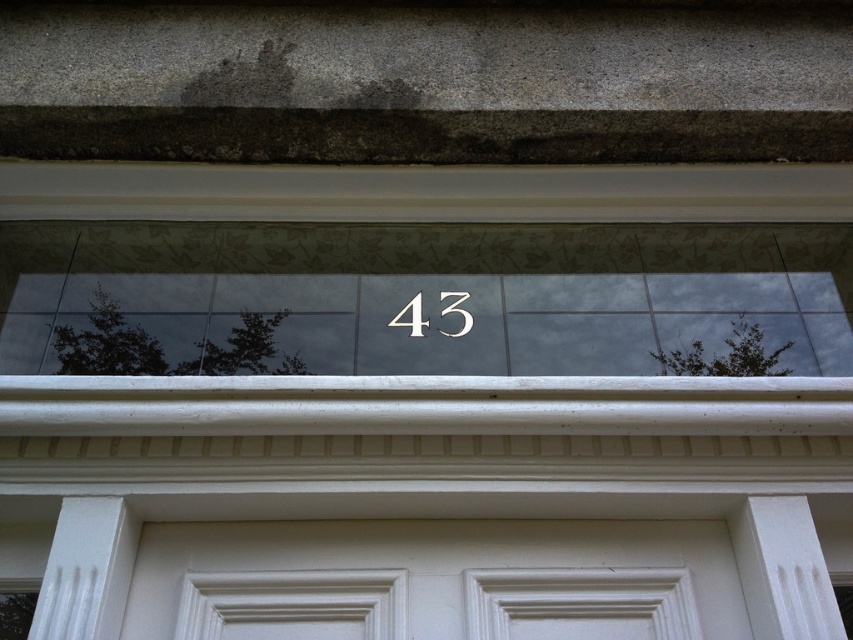
Question: Is transparent glass at center to the right of black metallic number at center from the viewer's perspective?

Choices:
 (A) no
 (B) yes

Answer: (B)

Question: Which point is closer to the camera?

Choices:
 (A) transparent glass at center
 (B) black metallic number at center

Answer: (A)

Question: Can you confirm if transparent glass at center is positioned to the right of black metallic number at center?

Choices:
 (A) no
 (B) yes

Answer: (B)

Question: Considering the relative positions of transparent glass at center and black metallic number at center in the image provided, where is transparent glass at center located with respect to black metallic number at center?

Choices:
 (A) left
 (B) right

Answer: (B)

Question: Which point appears farthest from the camera in this image?

Choices:
 (A) (599, 316)
 (B) (457, 301)

Answer: (B)